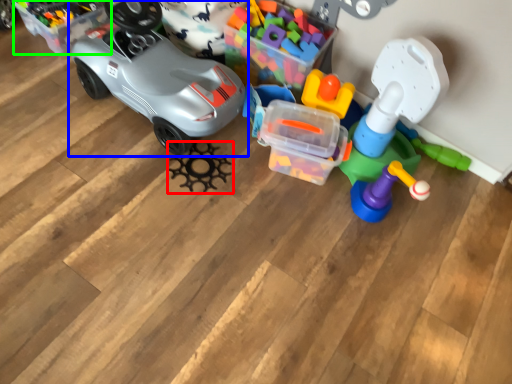
Question: Considering the real-world distances, which object is closest to toy (highlighted by a red box)? car (highlighted by a blue box) or storage box (highlighted by a green box).

Choices:
 (A) car
 (B) storage box

Answer: (A)